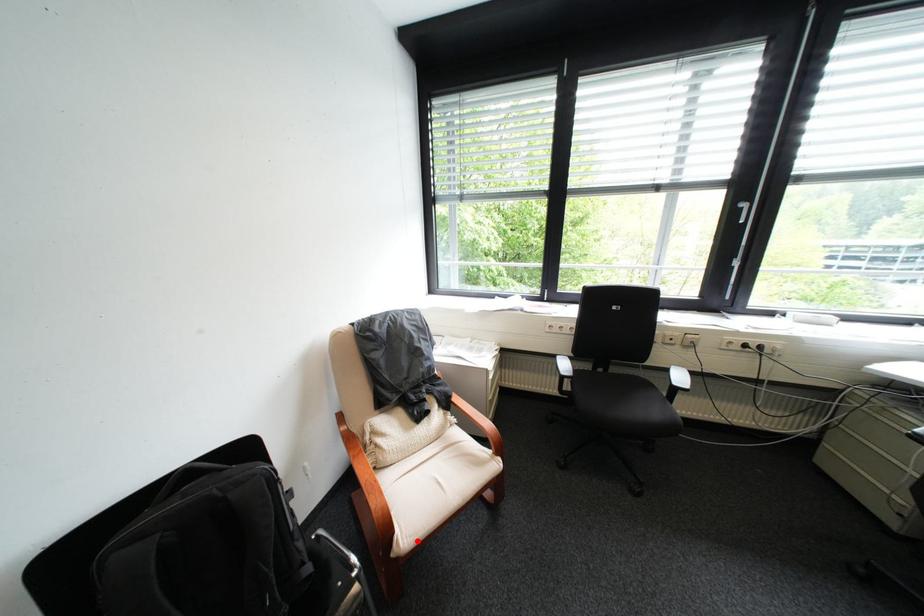
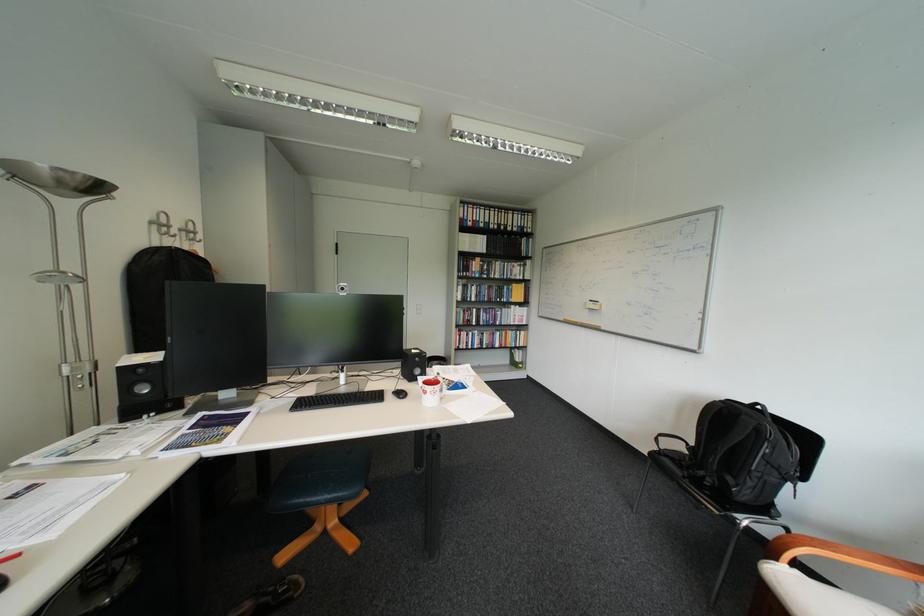
Question: I am providing you with two images of the same scene from different viewpoints. Given a red point in image1, look at the same physical point in image2. Is it:

Choices:
 (A) Closer to the viewpoint
 (B) Farther from the viewpoint

Answer: (B)